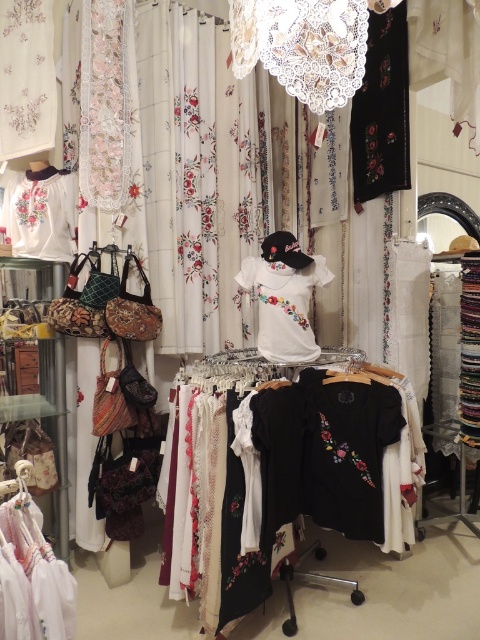
Is black cotton shirts at center wider than white embroidered blouse at upper left?

Yes.

Looking at this image, who is taller, black cotton shirts at center or white embroidered blouse at upper left?

Standing taller between the two is black cotton shirts at center.

Who is more distant from viewer, (193, 413) or (21, 182)?

The point (21, 182) is behind.

Where is `black cotton shirts at center`? Image resolution: width=480 pixels, height=640 pixels. black cotton shirts at center is located at coordinates (292, 476).

Between white embroidered shirt at center and white cotton blouse at lower left, which one is positioned higher?

white embroidered shirt at center is above.

Is white embroidered shirt at center to the right of white cotton blouse at lower left from the viewer's perspective?

Yes, white embroidered shirt at center is to the right of white cotton blouse at lower left.

At what (x,y) coordinates should I click in order to perform the action: click on white embroidered shirt at center. Please return your answer as a coordinate pair (x, y). Looking at the image, I should click on (284, 305).

Where is `white embroidered shirt at center`? This screenshot has width=480, height=640. white embroidered shirt at center is located at coordinates (284, 305).

Who is higher up, black cotton shirts at center or white cotton blouse at lower left?

white cotton blouse at lower left is higher up.

Is point (202, 572) positioned after point (23, 532)?

That is True.

Identify the location of black cotton shirts at center. The image size is (480, 640). (292, 476).

This screenshot has width=480, height=640. I want to click on black cotton shirts at center, so click(x=292, y=476).